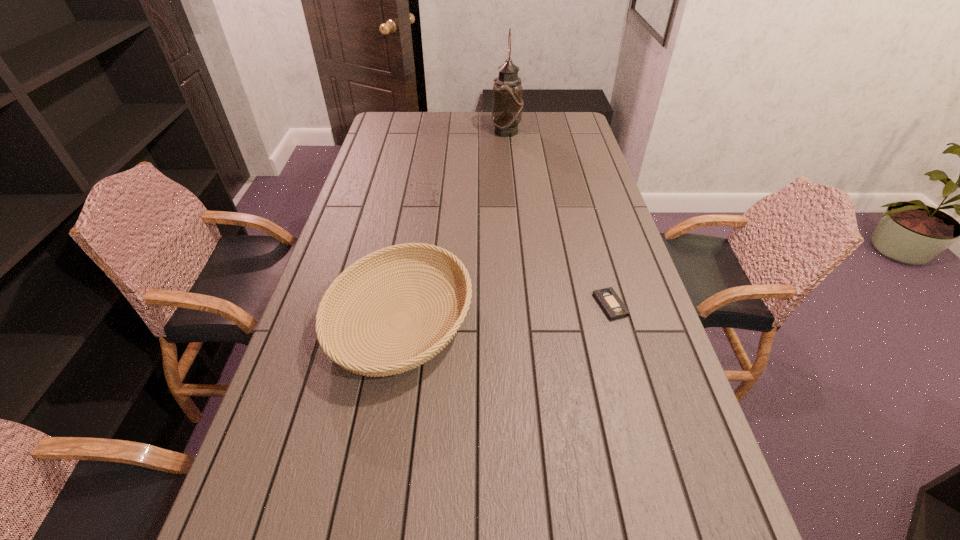
Locate an element on the screen. The height and width of the screenshot is (540, 960). unoccupied position between the second shortest object and the oil lamp is located at coordinates (465, 165).

You are a GUI agent. You are given a task and a screenshot of the screen. Output one action in this format:
    pyautogui.click(x=<x>, y=<y>)
    Task: Click on the free spot between the oil lamp and the basket
    This screenshot has width=960, height=540.
    Given the screenshot: What is the action you would take?
    pyautogui.click(x=453, y=226)

You are a GUI agent. You are given a task and a screenshot of the screen. Output one action in this format:
    pyautogui.click(x=<x>, y=<y>)
    Task: Click on the vacant area between the videotape and the second tallest object
    The image size is (960, 540).
    Given the screenshot: What is the action you would take?
    pyautogui.click(x=505, y=313)

Locate an element on the screen. This screenshot has width=960, height=540. vacant region between the spectacles and the second object from right to left is located at coordinates (465, 165).

This screenshot has height=540, width=960. Find the location of `free spot between the spectacles and the shortest object`. free spot between the spectacles and the shortest object is located at coordinates (516, 252).

Find the location of `blank region between the spectacles and the videotape`. blank region between the spectacles and the videotape is located at coordinates (516, 252).

Where is `vacant point located between the shortest object and the third shortest object`? The width and height of the screenshot is (960, 540). vacant point located between the shortest object and the third shortest object is located at coordinates (505, 313).

Find the location of `the closest object to the second object from right to left`. the closest object to the second object from right to left is located at coordinates (436, 191).

Locate which object ranks third in proximity to the rightmost object. Please provide its 2D coordinates. Your answer should be formatted as a tuple, i.e. [(x, y)], where the tuple contains the x and y coordinates of a point satisfying the conditions above.

[(507, 103)]

Find the location of a particular element. free location that satisfies the following two spatial constraints: 1. on the temples of the rightmost object; 2. on the right side of the spectacles is located at coordinates (406, 305).